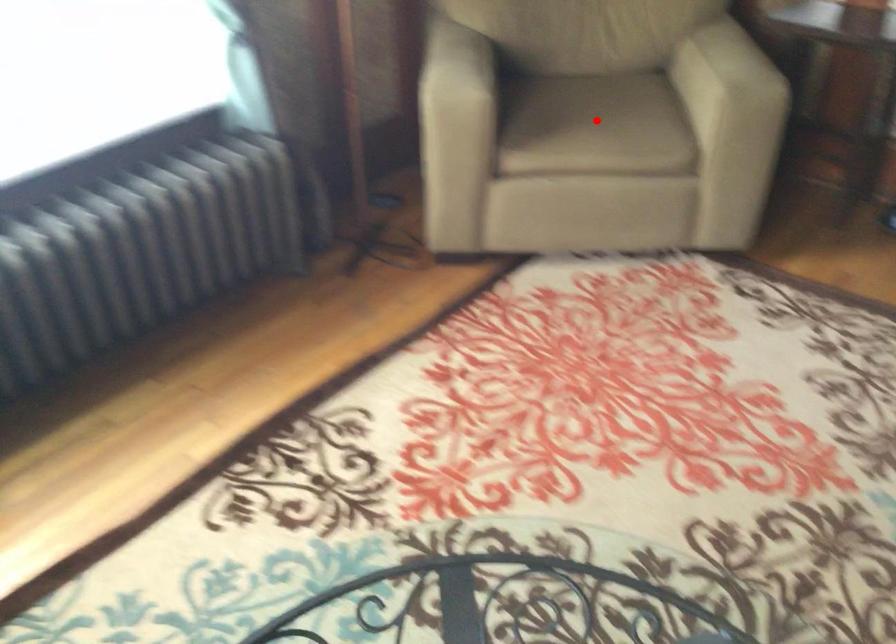
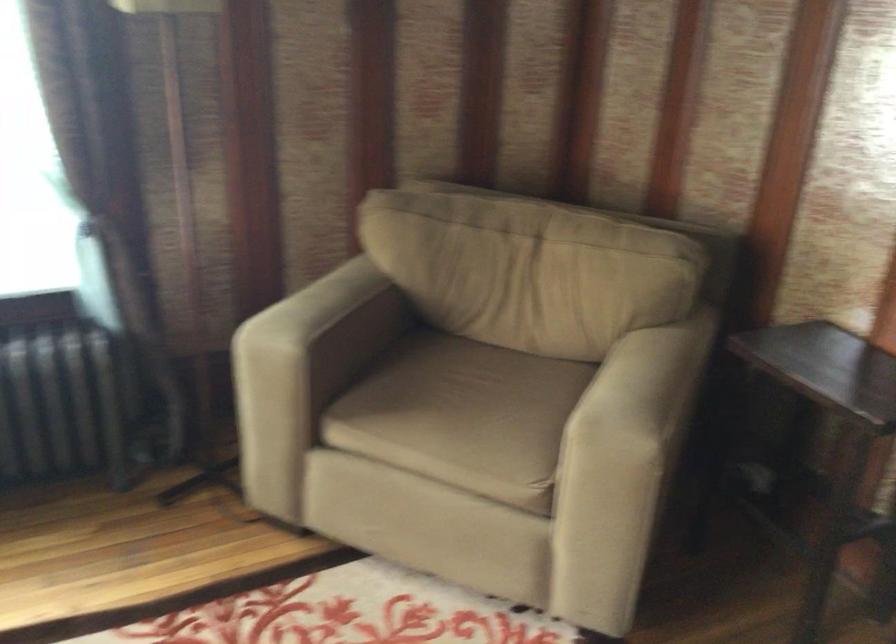
Question: I am providing you with two images of the same scene from different viewpoints. Given a red point in image1, look at the same physical point in image2. Is it:

Choices:
 (A) Closer to the viewpoint
 (B) Farther from the viewpoint

Answer: (A)